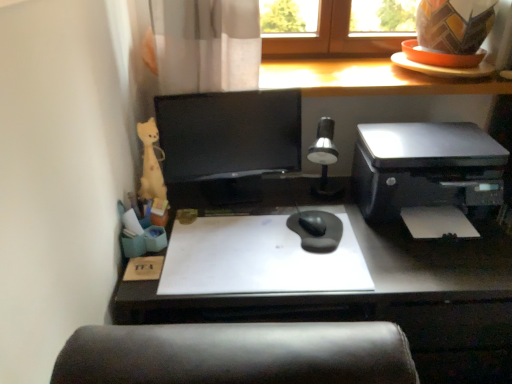
Image resolution: width=512 pixels, height=384 pixels. What are the coordinates of `vacant region above white paper at right (from a real-world perspective)` in the screenshot? It's located at (434, 215).